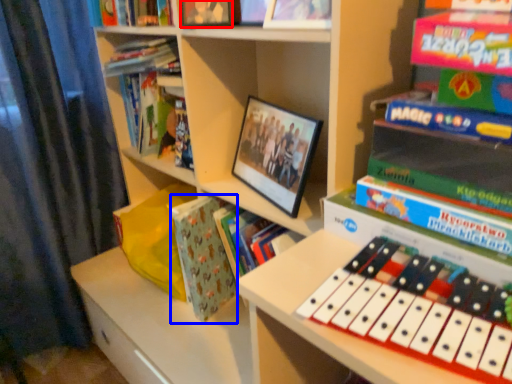
Question: Which object appears closest to the camera in this image, book (highlighted by a red box) or paperback book (highlighted by a blue box)?

Choices:
 (A) book
 (B) paperback book

Answer: (A)